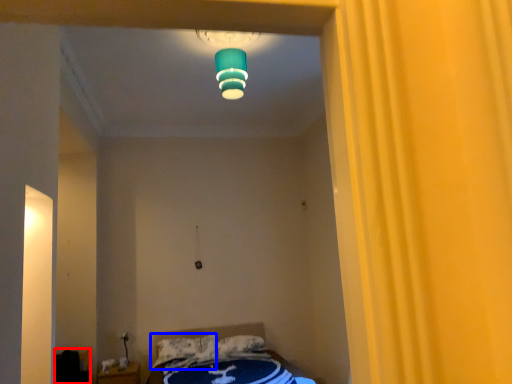
Question: Which object appears closest to the camera in this image, furniture (highlighted by a red box) or pillow (highlighted by a blue box)?

Choices:
 (A) furniture
 (B) pillow

Answer: (A)